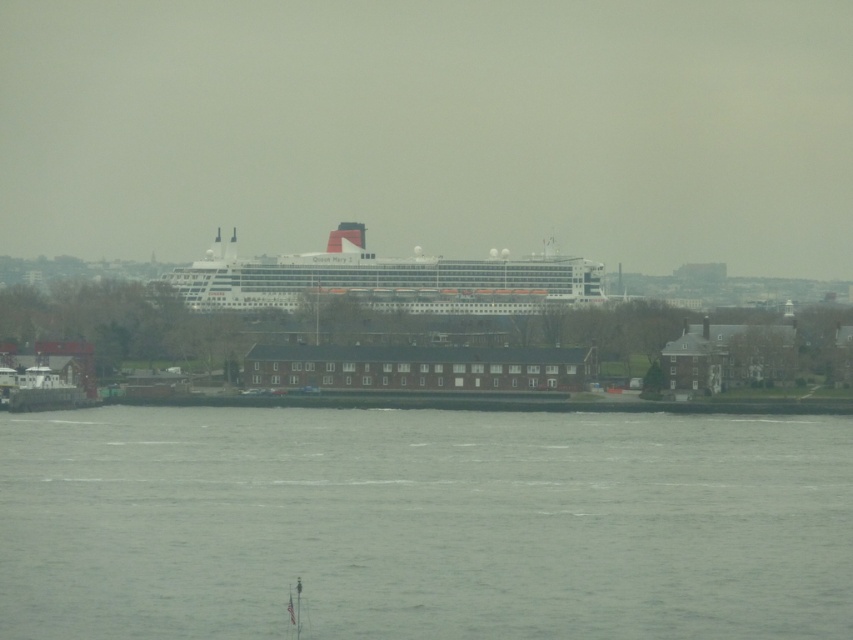
Question: Does gray water at lower center have a smaller size compared to white glossy cruise ship at center?

Choices:
 (A) no
 (B) yes

Answer: (A)

Question: Among these points, which one is nearest to the camera?

Choices:
 (A) (593, 616)
 (B) (235, 241)

Answer: (A)

Question: Can you confirm if gray water at lower center is positioned below white glossy cruise ship at center?

Choices:
 (A) yes
 (B) no

Answer: (A)

Question: Which object appears closest to the camera in this image?

Choices:
 (A) white glossy cruise ship at center
 (B) gray water at lower center

Answer: (B)

Question: Observing the image, what is the correct spatial positioning of gray water at lower center in reference to white glossy cruise ship at center?

Choices:
 (A) above
 (B) below

Answer: (B)